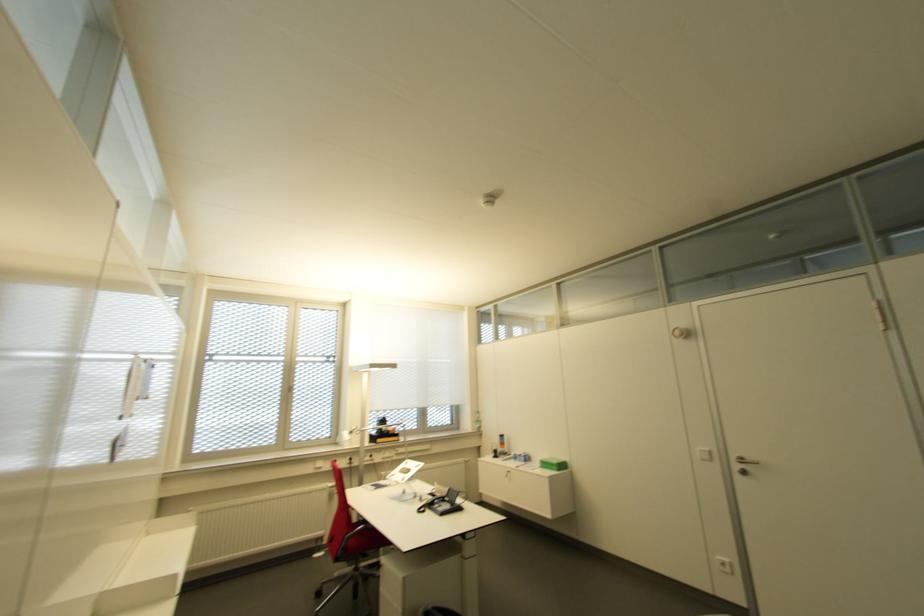
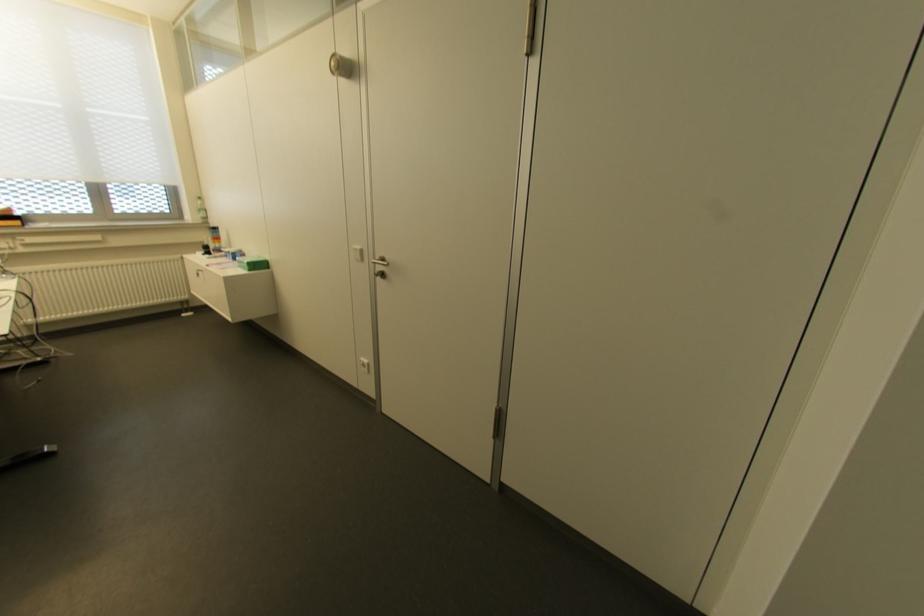
Find the pixel in the second image that matches [499,448] in the first image.

(213, 243)